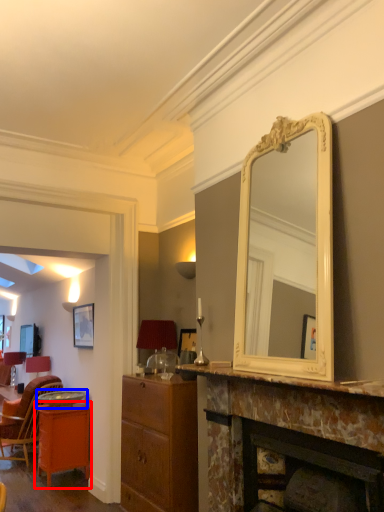
Question: Which object is further to the camera taking this photo, table (highlighted by a red box) or round table (highlighted by a blue box)?

Choices:
 (A) table
 (B) round table

Answer: (B)